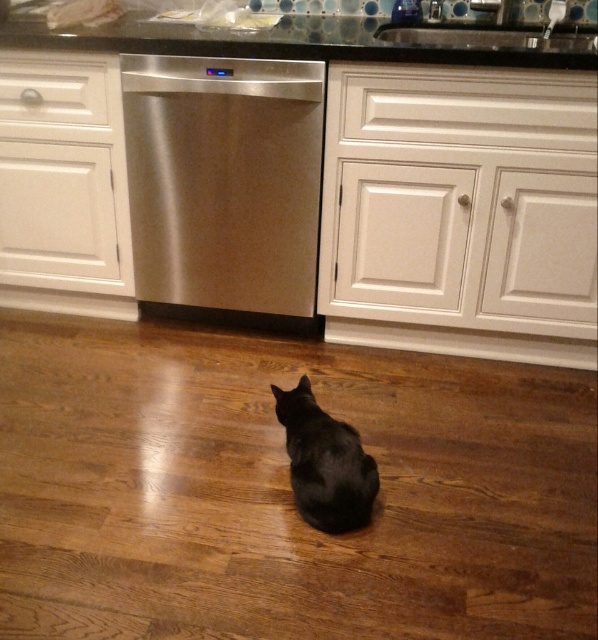
Looking at this image, between stainless steel dishwasher at center and black fur cat at center, which one appears on the left side from the viewer's perspective?

stainless steel dishwasher at center

Who is lower down, stainless steel dishwasher at center or black fur cat at center?

Positioned lower is black fur cat at center.

At what (x,y) coordinates should I click in order to perform the action: click on stainless steel dishwasher at center. Please return your answer as a coordinate pair (x, y). This screenshot has height=640, width=598. Looking at the image, I should click on (224, 180).

At what (x,y) coordinates should I click in order to perform the action: click on stainless steel dishwasher at center. Please return your answer as a coordinate pair (x, y). The image size is (598, 640). Looking at the image, I should click on (224, 180).

Is stainless steel dishwasher at center smaller than glassy granite countertop at upper center?

Indeed, stainless steel dishwasher at center has a smaller size compared to glassy granite countertop at upper center.

Image resolution: width=598 pixels, height=640 pixels. What do you see at coordinates (224, 180) in the screenshot?
I see `stainless steel dishwasher at center` at bounding box center [224, 180].

This screenshot has height=640, width=598. What are the coordinates of `stainless steel dishwasher at center` in the screenshot? It's located at (224, 180).

Does glassy granite countertop at upper center have a smaller size compared to black fur cat at center?

Incorrect, glassy granite countertop at upper center is not smaller in size than black fur cat at center.

Is glassy granite countertop at upper center taller than black fur cat at center?

Yes.

Is point (376, 26) positioned in front of point (319, 502)?

No, (376, 26) is behind (319, 502).

The image size is (598, 640). I want to click on glassy granite countertop at upper center, so (315, 29).